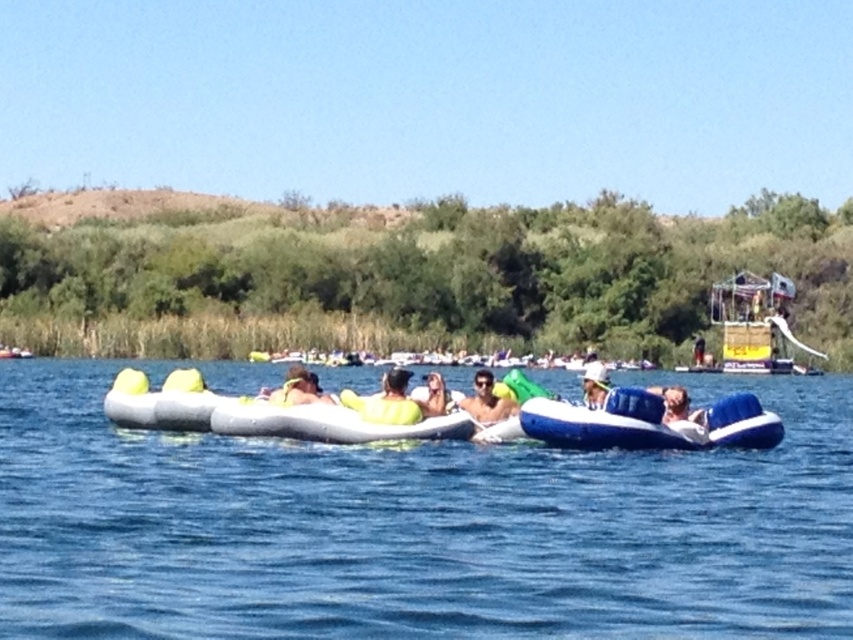
You are a swimmer who needs to reach the nearest life vest or ring to stay afloat. You are currently at the center of the image. Which object should you grab first, the matte yellow life vest at center or the yellow rubber ring at center?

The matte yellow life vest at center and the yellow rubber ring at center are both at the center of the image, but the distance between them is 3.47 meters. Since you are at the center, you can choose either as they are equidistant from your position.

You are standing at the viewpoint of the image and want to place a marker at both points. Which point, point (x=144, y=609) or point (x=686, y=408), is closer to you?

Point (x=144, y=609) is closer to the viewer than point (x=686, y=408).

You are standing at the center of the image and want to locate the blue inflatable raft at center. According to the coordinates provided, in which direction should you look to find it?

The blue inflatable raft at center is located at coordinates point (x=648, y=422), so you should look towards the lower right direction from the center to find it.